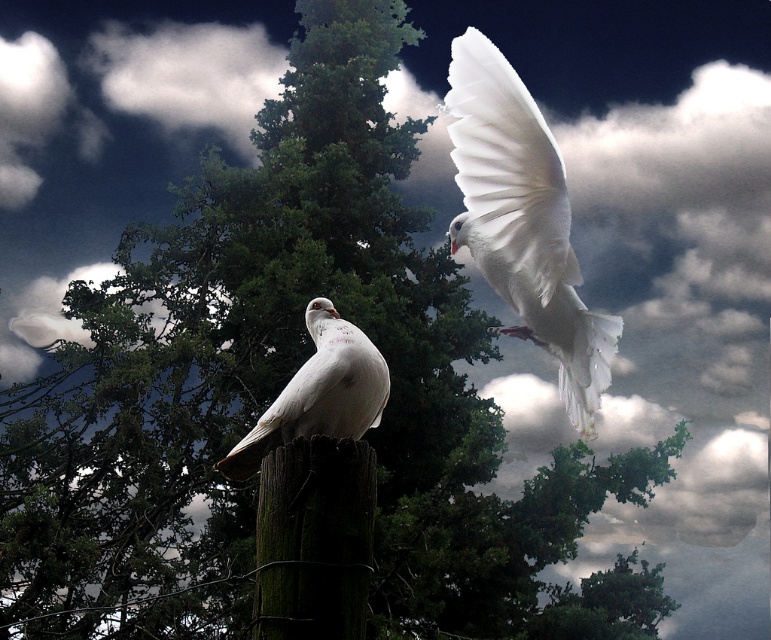
Question: Does white feathered dove at upper right have a smaller size compared to white matte dove at center?

Choices:
 (A) yes
 (B) no

Answer: (B)

Question: Is green mossy wood at center above white matte dove at center?

Choices:
 (A) yes
 (B) no

Answer: (B)

Question: Which of the following is the farthest from the observer?

Choices:
 (A) green mossy wood at center
 (B) white matte dove at center
 (C) white feathered dove at upper right

Answer: (B)

Question: Which point appears closest to the camera in this image?

Choices:
 (A) (295, 403)
 (B) (547, 314)
 (C) (338, 621)

Answer: (C)

Question: Is green mossy wood at center wider than white matte dove at center?

Choices:
 (A) no
 (B) yes

Answer: (A)

Question: Which of the following is the farthest from the observer?

Choices:
 (A) (359, 552)
 (B) (332, 384)

Answer: (B)